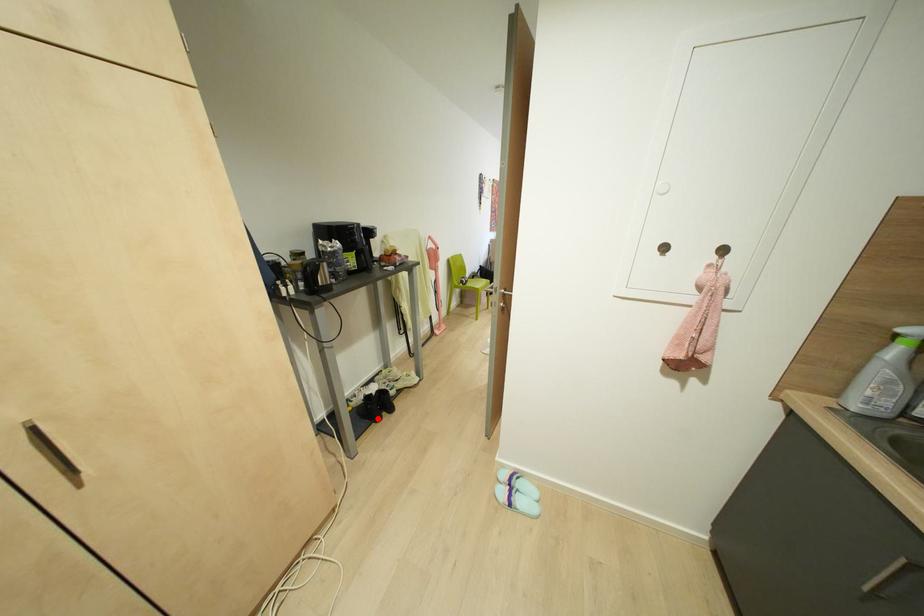
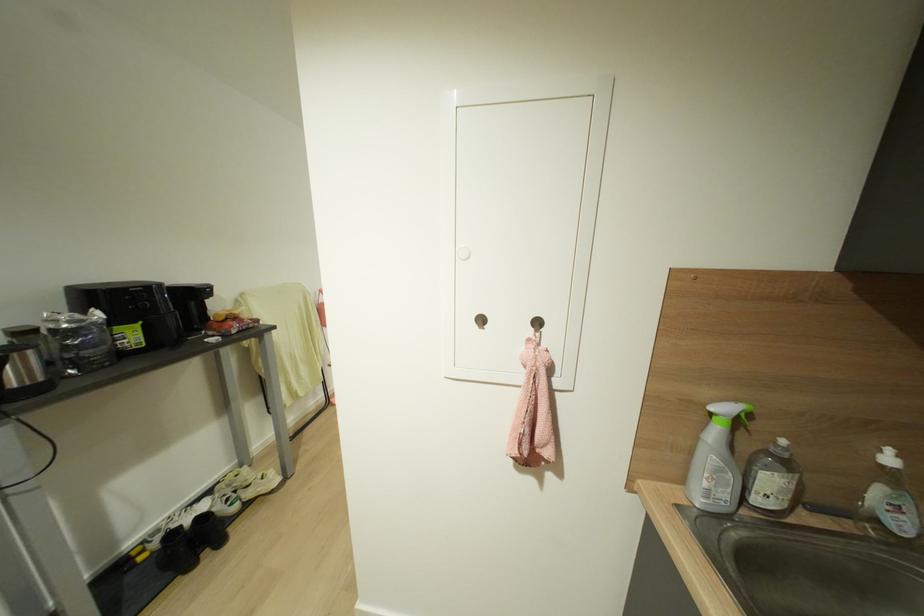
Question: I am providing you with two images of the same scene from different viewpoints. Image1 has a red point marked. In image2, the corresponding 3D location appears at what relative position? Reply with the corresponding letter.

Choices:
 (A) Closer
 (B) Farther

Answer: (A)